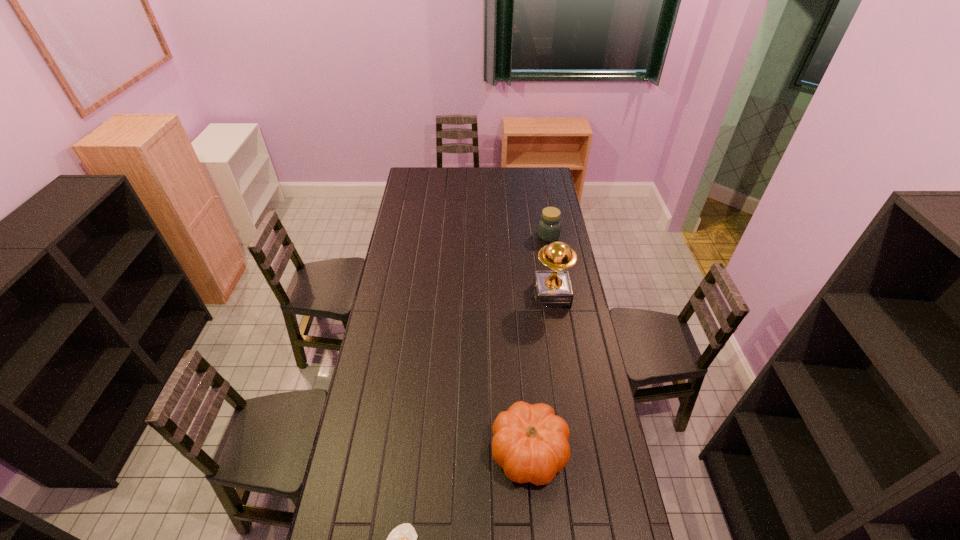
The image size is (960, 540). In order to click on free location located on the front of the farthest object in this screenshot , I will do `click(557, 283)`.

This screenshot has width=960, height=540. Find the location of `award that is positioned at the right edge`. award that is positioned at the right edge is located at coordinates (552, 289).

The image size is (960, 540). Find the location of `jar located in the right edge section of the desktop`. jar located in the right edge section of the desktop is located at coordinates (549, 226).

Find the location of a particular element. This screenshot has height=540, width=960. free space at the far edge of the desktop is located at coordinates (475, 176).

At what (x,y) coordinates should I click in order to perform the action: click on vacant space at the left edge. Please return your answer as a coordinate pair (x, y). Looking at the image, I should click on (411, 276).

In the image, there is a desktop. At what (x,y) coordinates should I click in order to perform the action: click on blank space at the right edge. Please return your answer as a coordinate pair (x, y). The height and width of the screenshot is (540, 960). Looking at the image, I should click on (566, 363).

This screenshot has width=960, height=540. Find the location of `free space at the far left corner`. free space at the far left corner is located at coordinates (408, 182).

This screenshot has height=540, width=960. What are the coordinates of `free space at the far right corner` in the screenshot? It's located at point(529,177).

Find the location of `free area in between the award and the third farthest object`. free area in between the award and the third farthest object is located at coordinates (540, 374).

This screenshot has height=540, width=960. In order to click on empty space that is in between the third farthest object and the jar in this screenshot , I will do `click(539, 344)`.